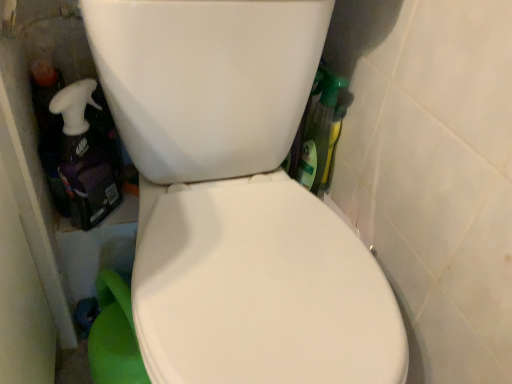
Question: Considering the positions of point (68, 145) and point (172, 205), is point (68, 145) closer or farther from the camera than point (172, 205)?

Choices:
 (A) farther
 (B) closer

Answer: (A)

Question: In terms of size, does translucent purple spray bottle at left appear bigger or smaller than white glossy toilet at center?

Choices:
 (A) small
 (B) big

Answer: (A)

Question: From the image's perspective, is translucent purple spray bottle at left located above or below white glossy toilet at center?

Choices:
 (A) below
 (B) above

Answer: (B)

Question: From the image's perspective, is white glossy toilet at center positioned above or below translucent purple spray bottle at left?

Choices:
 (A) below
 (B) above

Answer: (A)

Question: Is white glossy toilet at center to the left or to the right of translucent purple spray bottle at left in the image?

Choices:
 (A) right
 (B) left

Answer: (A)

Question: Is point (131, 39) positioned closer to the camera than point (77, 208)?

Choices:
 (A) farther
 (B) closer

Answer: (B)

Question: From a real-world perspective, is white glossy toilet at center positioned above or below translucent purple spray bottle at left?

Choices:
 (A) below
 (B) above

Answer: (A)